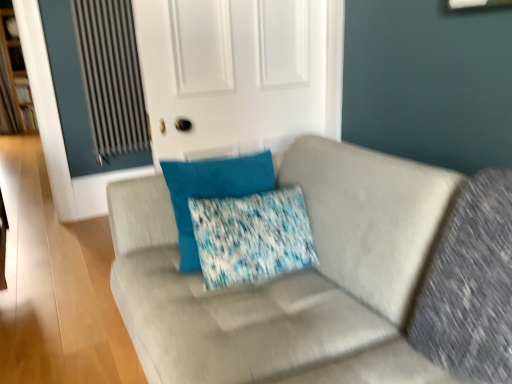
Question: Is point (125, 231) positioned closer to the camera than point (252, 238)?

Choices:
 (A) farther
 (B) closer

Answer: (A)

Question: In terms of size, does suede gray couch at center appear bigger or smaller than blue textured pillow at center?

Choices:
 (A) small
 (B) big

Answer: (B)

Question: Estimate the real-world distances between objects in this image. Which object is closer to the blue textured pillow at center?

Choices:
 (A) metallic ribbed radiator at upper left
 (B) suede gray couch at center
 (C) white matte door at upper center
 (D) wooden bookshelf at left
 (E) blue fabric pillow at center

Answer: (E)

Question: Which object is positioned farthest from the metallic ribbed radiator at upper left?

Choices:
 (A) white matte door at upper center
 (B) blue textured pillow at center
 (C) blue fabric pillow at center
 (D) suede gray couch at center
 (E) wooden bookshelf at left

Answer: (E)